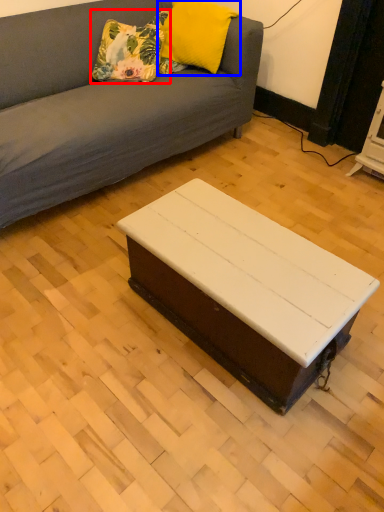
Question: Which of the following is the closest to the observer, pillow (highlighted by a red box) or pillow (highlighted by a blue box)?

Choices:
 (A) pillow
 (B) pillow

Answer: (B)